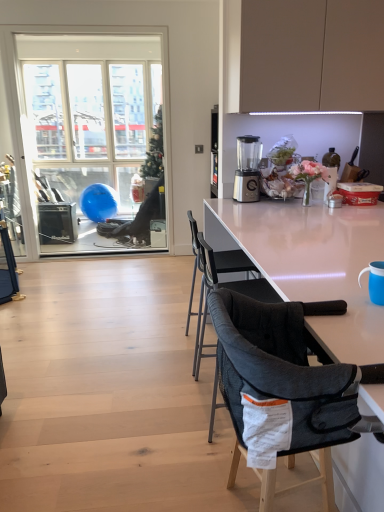
Locate an element on the screen. This screenshot has height=512, width=384. free space in front of sleek silver blender at center is located at coordinates (246, 201).